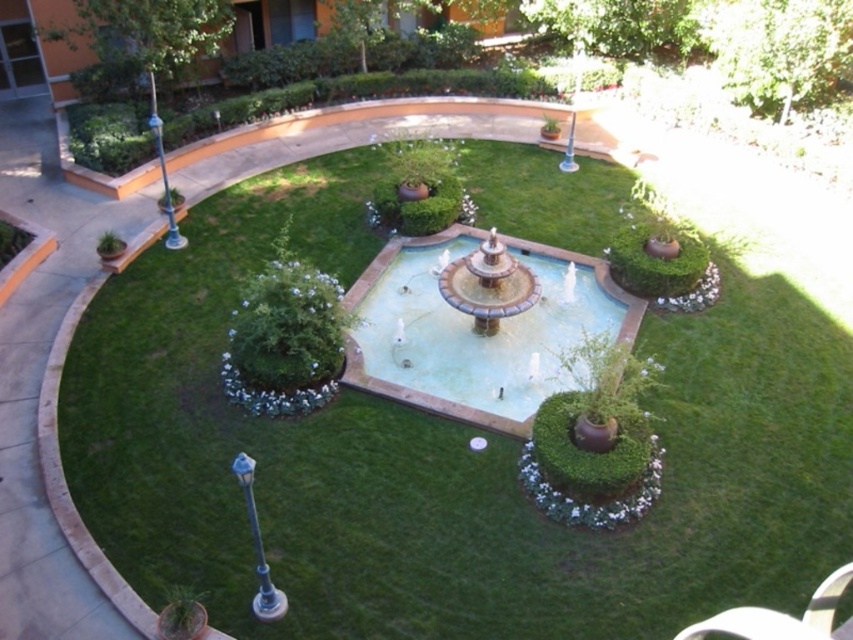
Question: Is green grass at center below smooth stone fountain at center?

Choices:
 (A) yes
 (B) no

Answer: (A)

Question: Among these objects, which one is farthest from the camera?

Choices:
 (A) smooth stone fountain at center
 (B) green grass at center

Answer: (A)

Question: Can you confirm if green grass at center is positioned to the left of smooth stone fountain at center?

Choices:
 (A) no
 (B) yes

Answer: (B)

Question: Can you confirm if green grass at center is bigger than smooth stone fountain at center?

Choices:
 (A) no
 (B) yes

Answer: (B)